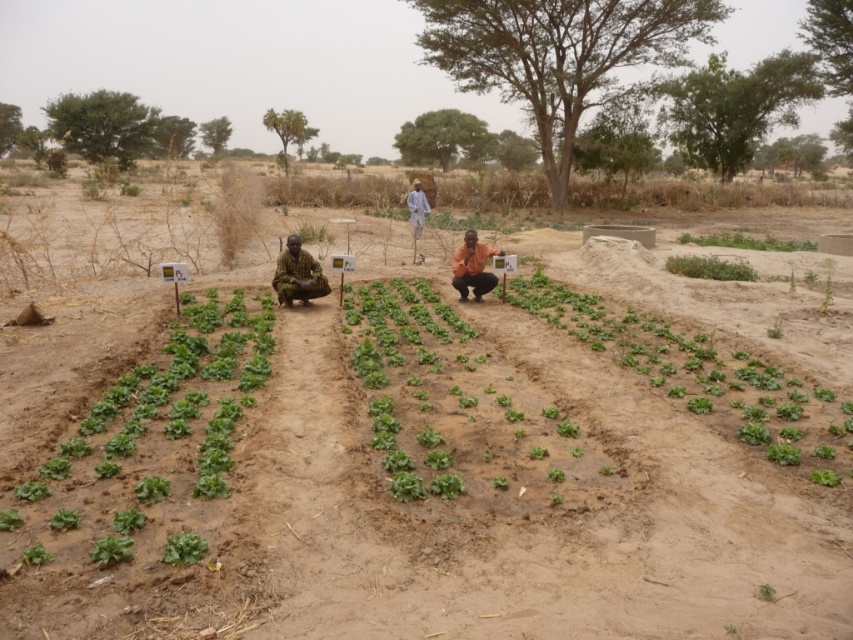
Question: Is green leafy lettuce at lower left closer to camera compared to light blue fabric at center?

Choices:
 (A) no
 (B) yes

Answer: (B)

Question: Which is nearer to the green leafy at center?

Choices:
 (A) green leafy lettuce at lower left
 (B) orange fabric person at center

Answer: (B)

Question: Which object appears closest to the camera in this image?

Choices:
 (A) green leafy at center
 (B) green leafy plant at lower right

Answer: (A)

Question: Which object is closer to the camera taking this photo?

Choices:
 (A) green leafy at center
 (B) green leafy plant at center
 (C) green leafy plant at lower right
 (D) green leafy at left

Answer: (D)

Question: Is the position of green leafy vegetable at center less distant than that of green leafy at center?

Choices:
 (A) yes
 (B) no

Answer: (A)

Question: Is orange fabric person at center above green leafy plant at center?

Choices:
 (A) no
 (B) yes

Answer: (A)